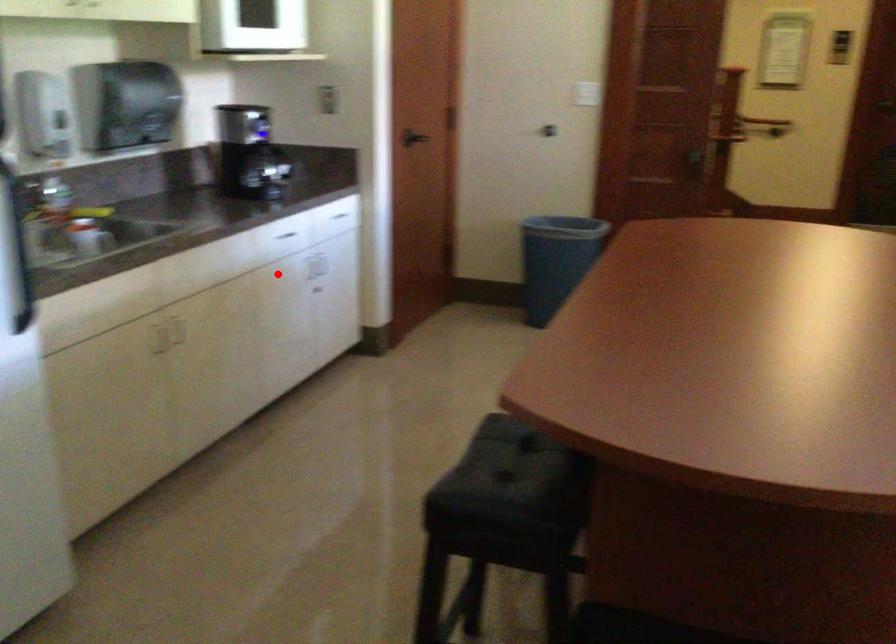
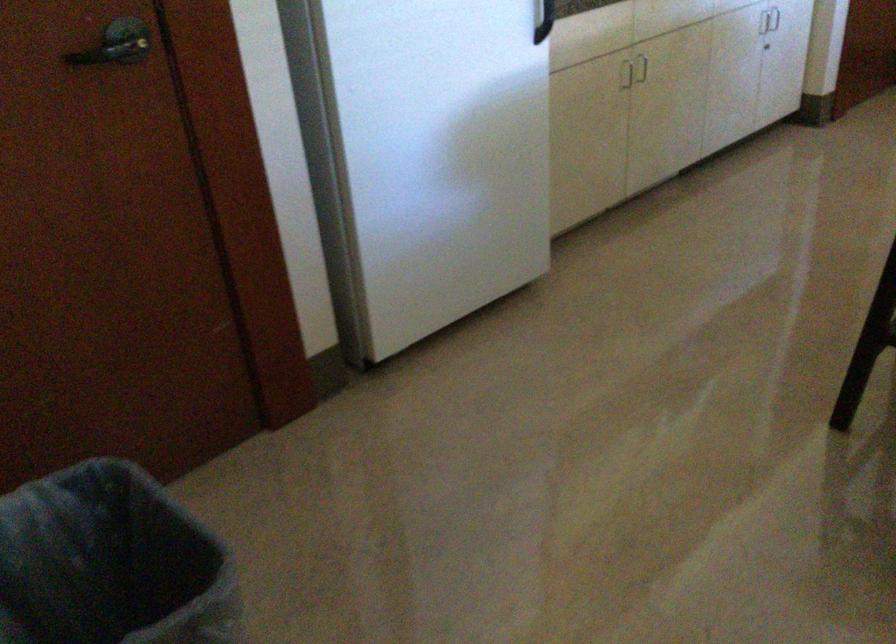
Where in the second image is the point corresponding to the highlighted location from the first image?

(769, 20)